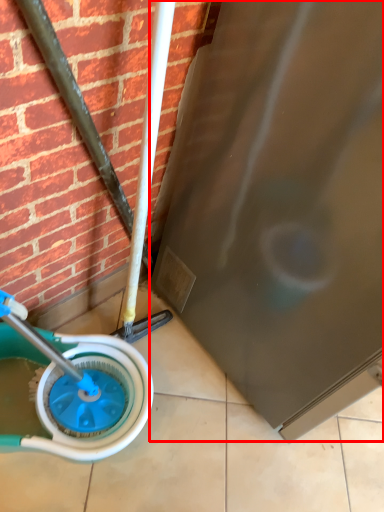
Question: Considering the relative positions of screen door (annotated by the red box) and wheel in the image provided, where is screen door (annotated by the red box) located with respect to the staircase?

Choices:
 (A) left
 (B) right

Answer: (B)